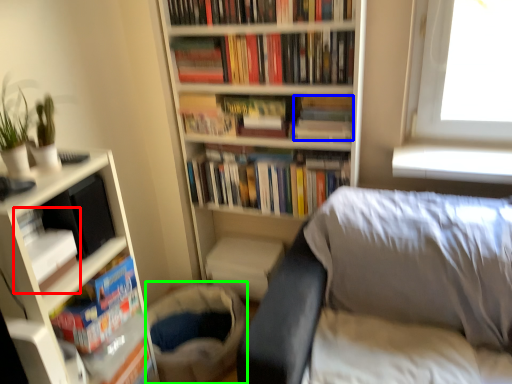
Question: Considering the real-world distances, which object is closest to book (highlighted by a red box)? book (highlighted by a blue box) or gray (highlighted by a green box).

Choices:
 (A) book
 (B) gray

Answer: (B)